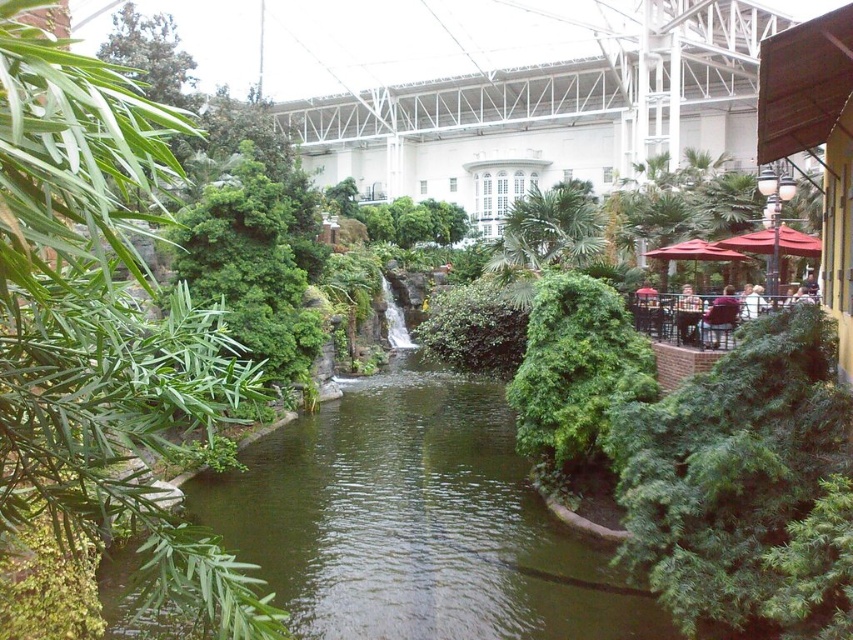
Is green leafy tree at left further to camera compared to red fabric umbrella at right?

No, it is in front of red fabric umbrella at right.

Who is lower down, green leafy tree at left or red fabric umbrella at right?

Positioned lower is green leafy tree at left.

You are a GUI agent. You are given a task and a screenshot of the screen. Output one action in this format:
    pyautogui.click(x=<x>, y=<y>)
    Task: Click on the green leafy tree at left
    
    Given the screenshot: What is the action you would take?
    pyautogui.click(x=105, y=339)

The image size is (853, 640). In order to click on green leafy tree at left in this screenshot , I will do `click(105, 339)`.

Who is shorter, green leafy palm tree at center or red fabric umbrella at right?

red fabric umbrella at right

Which is in front, point (538, 205) or point (703, 250)?

Point (703, 250) is in front.

At what (x,y) coordinates should I click in order to perform the action: click on green leafy palm tree at center. Please return your answer as a coordinate pair (x, y). The width and height of the screenshot is (853, 640). Looking at the image, I should click on (549, 230).

Measure the distance from green leafy tree at left to green leafy palm tree at center.

22.94 meters

Which is in front, point (144, 611) or point (544, 200)?

Positioned in front is point (144, 611).

The width and height of the screenshot is (853, 640). Identify the location of green leafy tree at left. (105, 339).